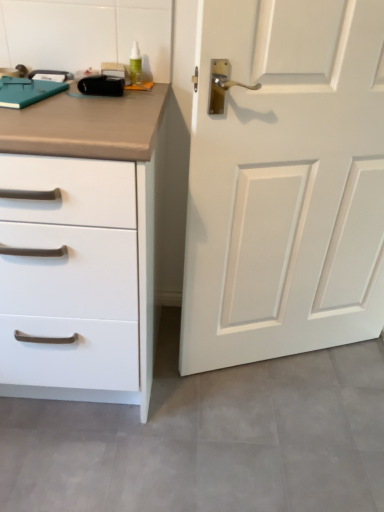
Question: Is white matte chest of drawers at left oriented towards white matte door at right?

Choices:
 (A) no
 (B) yes

Answer: (A)

Question: Is white matte chest of drawers at left outside of white matte door at right?

Choices:
 (A) yes
 (B) no

Answer: (A)

Question: Does white matte chest of drawers at left contain white matte door at right?

Choices:
 (A) no
 (B) yes

Answer: (A)

Question: Is white matte door at right at the back of white matte chest of drawers at left?

Choices:
 (A) no
 (B) yes

Answer: (A)

Question: Does white matte chest of drawers at left have a larger size compared to white matte door at right?

Choices:
 (A) yes
 (B) no

Answer: (A)

Question: Considering the relative sizes of white matte chest of drawers at left and white matte door at right in the image provided, is white matte chest of drawers at left thinner than white matte door at right?

Choices:
 (A) no
 (B) yes

Answer: (A)

Question: Could you tell me if white matte door at right is turned towards white matte chest of drawers at left?

Choices:
 (A) yes
 (B) no

Answer: (B)

Question: Is white matte chest of drawers at left completely or partially inside white matte door at right?

Choices:
 (A) no
 (B) yes

Answer: (A)

Question: From a real-world perspective, is white matte door at right located beneath white matte chest of drawers at left?

Choices:
 (A) no
 (B) yes

Answer: (A)

Question: Is the depth of white matte door at right less than that of white matte chest of drawers at left?

Choices:
 (A) no
 (B) yes

Answer: (A)

Question: Considering the relative sizes of white matte door at right and white matte chest of drawers at left in the image provided, is white matte door at right smaller than white matte chest of drawers at left?

Choices:
 (A) yes
 (B) no

Answer: (A)

Question: Considering the relative sizes of white matte door at right and white matte chest of drawers at left in the image provided, is white matte door at right thinner than white matte chest of drawers at left?

Choices:
 (A) yes
 (B) no

Answer: (A)

Question: Considering the positions of point (359, 306) and point (79, 119), is point (359, 306) closer or farther from the camera than point (79, 119)?

Choices:
 (A) farther
 (B) closer

Answer: (A)